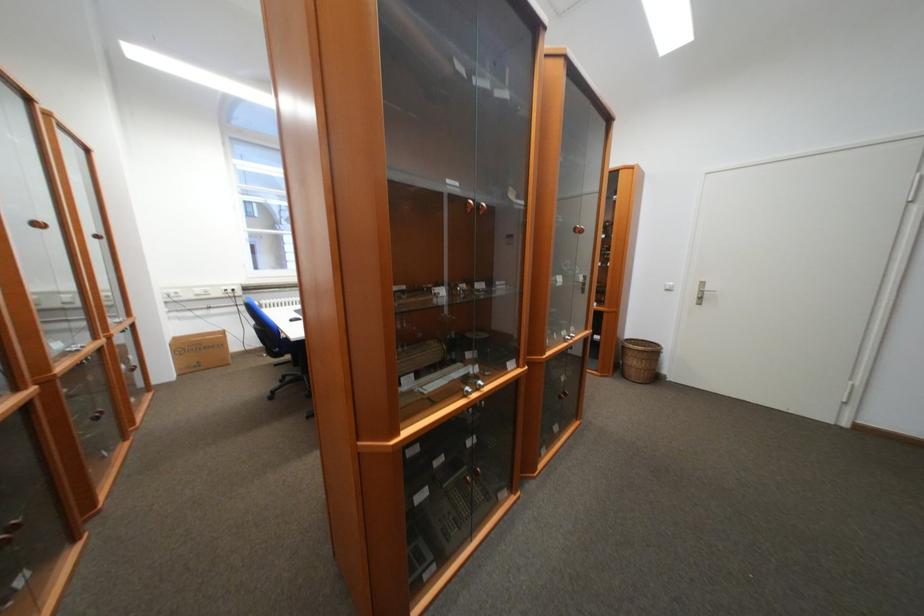
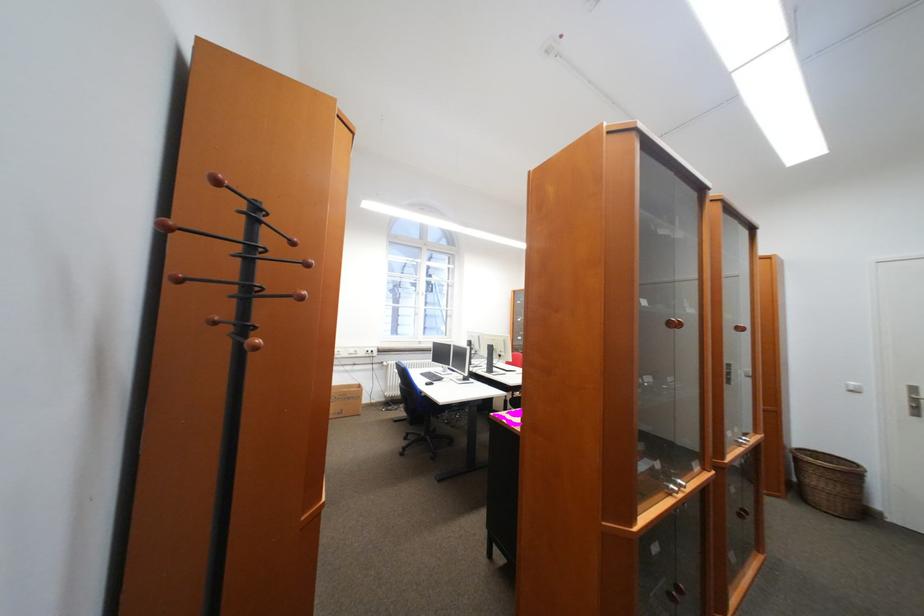
Find the pixel in the second image that matches the point at 290,382 in the first image.

(415, 439)